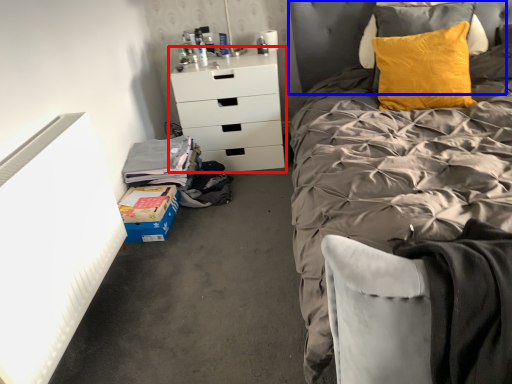
Question: Among these objects, which one is farthest to the camera, chest of drawers (highlighted by a red box) or headboard (highlighted by a blue box)?

Choices:
 (A) chest of drawers
 (B) headboard

Answer: (A)